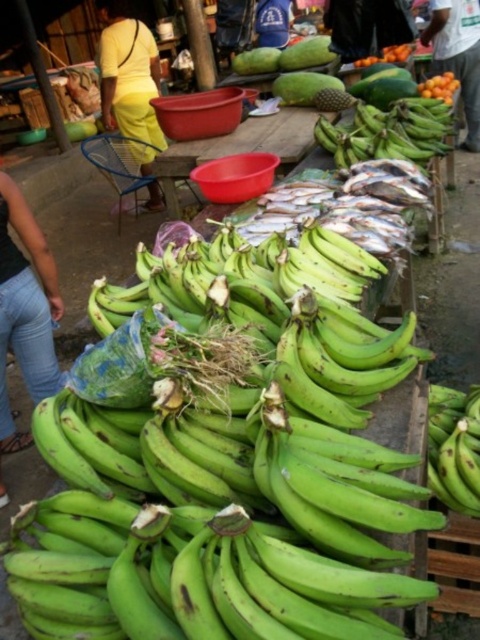
You are a customer at the market and want to buy some bananas and fish. The wooden table at center has bananas, and the orange matte at upper center is a sign. Where should you look first to find the bananas?

The wooden table at center is below the orange matte at upper center, so the bananas are located on the wooden table at center which is positioned lower than the orange matte at upper center. You should look at the wooden table at center first to find the bananas.

What are the coordinates of the wooden table at center?

The wooden table at center is located at coordinates point (238,147).